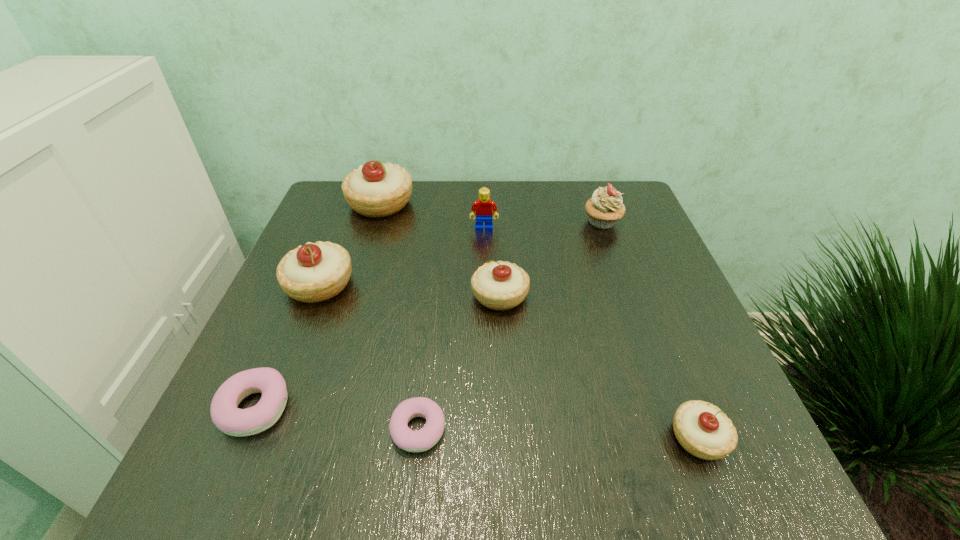
Find the location of a particular element. The height and width of the screenshot is (540, 960). vacant region between the fourth pastry from left to right and the red Lego is located at coordinates (451, 329).

The image size is (960, 540). In order to click on vacant area that lies between the fifth shortest pastry and the cupcake in this screenshot , I will do `click(461, 253)`.

At what (x,y) coordinates should I click in order to perform the action: click on free spot between the second shortest pastry and the third beige pastry from left to right. Please return your answer as a coordinate pair (x, y). The height and width of the screenshot is (540, 960). Looking at the image, I should click on (377, 352).

Image resolution: width=960 pixels, height=540 pixels. In order to click on vacant area between the biggest beige pastry and the Lego in this screenshot , I will do pyautogui.click(x=432, y=216).

At what (x,y) coordinates should I click in order to perform the action: click on object that stands as the seventh closest to the third smallest beige pastry. Please return your answer as a coordinate pair (x, y). This screenshot has height=540, width=960. Looking at the image, I should click on (702, 429).

Find the location of a particular element. The height and width of the screenshot is (540, 960). object that stands as the closest to the Lego is located at coordinates (375, 189).

Locate which pastry is the fifth closest to the second shortest object. Please provide its 2D coordinates. Your answer should be formatted as a tuple, i.e. [(x, y)], where the tuple contains the x and y coordinates of a point satisfying the conditions above.

[(702, 429)]

Locate an element on the screen. This screenshot has height=540, width=960. pastry that is the second nearest to the third smallest beige pastry is located at coordinates (231, 420).

Where is `beige pastry that is the nearest to the second tallest pastry`? This screenshot has width=960, height=540. beige pastry that is the nearest to the second tallest pastry is located at coordinates (375, 189).

Where is `beige pastry object that ranks as the second closest to the third smallest beige pastry`? The width and height of the screenshot is (960, 540). beige pastry object that ranks as the second closest to the third smallest beige pastry is located at coordinates (499, 285).